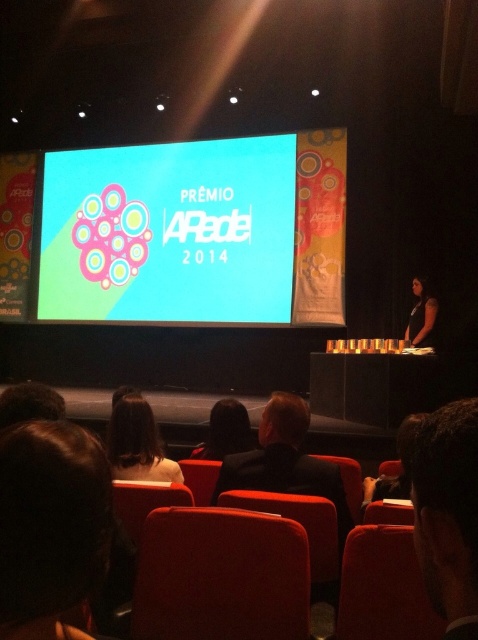
Question: Among these objects, which one is farthest from the camera?

Choices:
 (A) black suit at center
 (B) dark brown hair at upper right

Answer: (A)

Question: Does dark brown hair at upper right have a larger size compared to dark brown hair at lower center?

Choices:
 (A) yes
 (B) no

Answer: (B)

Question: Among these objects, which one is nearest to the camera?

Choices:
 (A) dark brown hair at upper right
 (B) dark brown hair at lower center
 (C) dark brown hair at center
 (D) brown hair at lower left

Answer: (A)

Question: Does dark brown hair at center have a smaller size compared to dark brown hair at lower center?

Choices:
 (A) yes
 (B) no

Answer: (A)

Question: Does dark brown hair at center have a larger size compared to dark brown hair at lower center?

Choices:
 (A) yes
 (B) no

Answer: (B)

Question: Which point is closer to the camera taking this photo?

Choices:
 (A) (218, 426)
 (B) (391, 490)
 (C) (275, 189)
 (D) (434, 444)

Answer: (D)